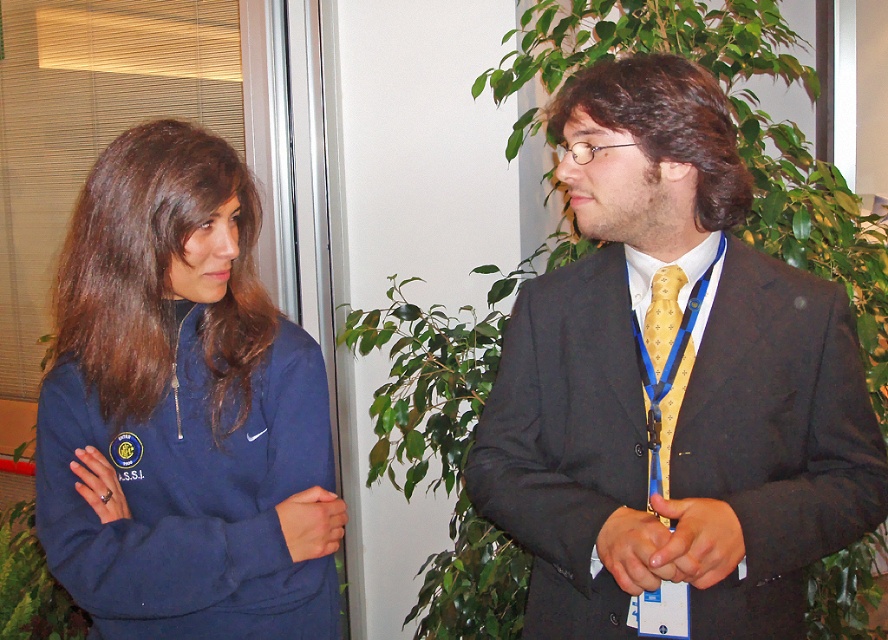
Who is taller, matte black suit at center or yellowtexturetie at center?

With more height is matte black suit at center.

Between matte black suit at center and yellowtexturetie at center, which one appears on the right side from the viewer's perspective?

matte black suit at center

Who is more distant from viewer, (757, 264) or (676, 348)?

The point (757, 264) is behind.

The width and height of the screenshot is (888, 640). I want to click on matte black suit at center, so click(x=679, y=449).

Which is in front, point (213, 632) or point (686, 374)?

Point (686, 374)

Does navy fleece sweatshirt at left have a greater height compared to yellowtexturetie at center?

Yes, navy fleece sweatshirt at left is taller than yellowtexturetie at center.

Locate an element on the screen. navy fleece sweatshirt at left is located at coordinates (181, 410).

Who is shorter, matte black suit at center or navy fleece sweatshirt at left?

navy fleece sweatshirt at left

Which is behind, point (625, 292) or point (96, 486)?

Positioned behind is point (625, 292).

What are the coordinates of `matte black suit at center` in the screenshot? It's located at (679, 449).